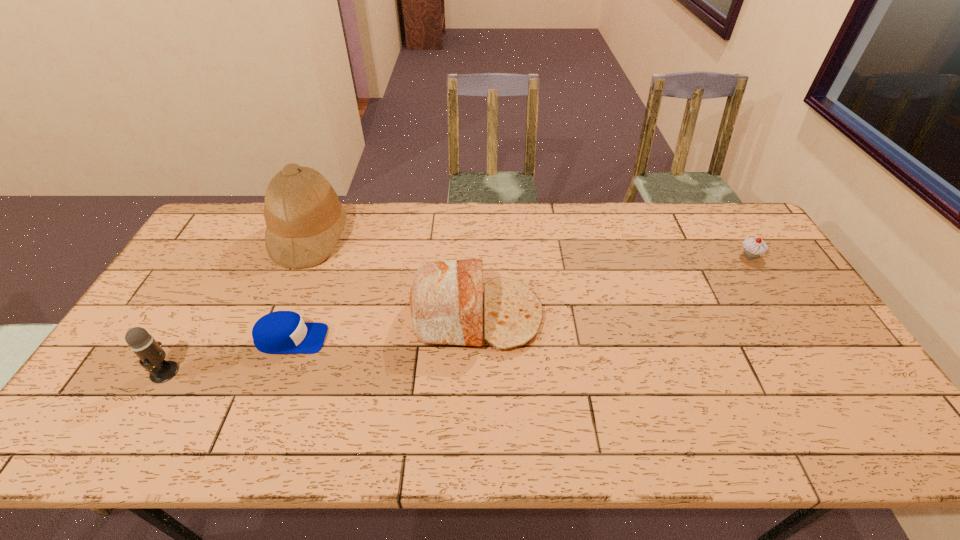
I want to click on the tallest object, so click(x=304, y=218).

Locate an element on the screen. Image resolution: width=960 pixels, height=540 pixels. the nearest object is located at coordinates (150, 352).

Where is `microphone`? The height and width of the screenshot is (540, 960). microphone is located at coordinates (150, 352).

Find the location of a particular element. bread is located at coordinates (446, 299).

At what (x,y) coordinates should I click in order to perform the action: click on cupcake. Please return your answer as a coordinate pair (x, y). Image resolution: width=960 pixels, height=540 pixels. Looking at the image, I should click on (753, 247).

Locate an element on the screen. This screenshot has height=540, width=960. the rightmost object is located at coordinates (753, 247).

Find the location of a particular element. Image resolution: width=960 pixels, height=540 pixels. the shortest object is located at coordinates (281, 332).

Locate an element on the screen. Image resolution: width=960 pixels, height=540 pixels. vacant space situated 0.100m on the front-facing side of the tallest object is located at coordinates (377, 237).

Locate an element on the screen. This screenshot has height=540, width=960. vacant space located on the back of the microphone is located at coordinates (228, 265).

Image resolution: width=960 pixels, height=540 pixels. Find the location of `free spot located 0.100m at the sliced end of the fourth object from left to right`. free spot located 0.100m at the sliced end of the fourth object from left to right is located at coordinates (577, 316).